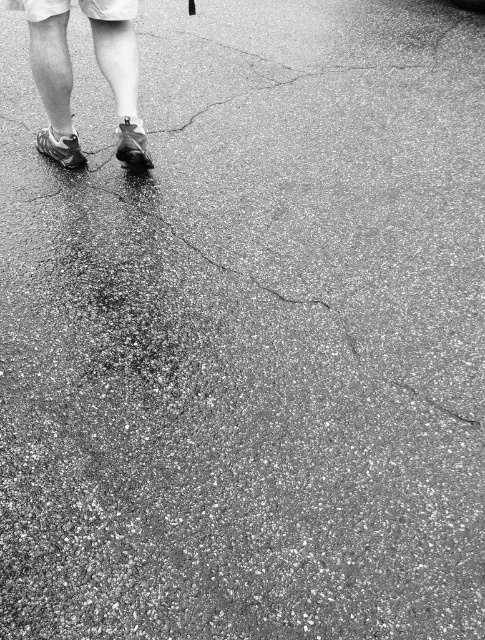
Question: Can you confirm if matte black sneakers at lower left is positioned below shiny black sandal at center?

Choices:
 (A) yes
 (B) no

Answer: (B)

Question: Is matte black sneakers at lower left above shiny black shoe at lower left?

Choices:
 (A) no
 (B) yes

Answer: (B)

Question: Is the position of matte black sneakers at lower left less distant than that of shiny black shoe at lower left?

Choices:
 (A) yes
 (B) no

Answer: (A)

Question: Which of these objects is positioned closest to the matte black sneakers at lower left?

Choices:
 (A) shiny black shoe at lower left
 (B) shiny black sandal at center

Answer: (B)

Question: Which object is farther from the camera taking this photo?

Choices:
 (A) shiny black sandal at center
 (B) shiny black shoe at lower left

Answer: (B)

Question: Which is farther from the shiny black shoe at lower left?

Choices:
 (A) shiny black sandal at center
 (B) matte black sneakers at lower left

Answer: (A)